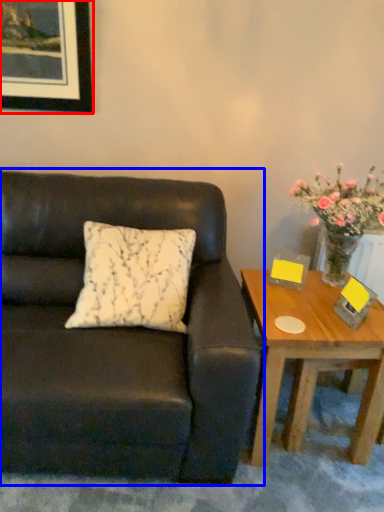
Question: Which of the following is the closest to the observer, picture frame (highlighted by a red box) or studio couch (highlighted by a blue box)?

Choices:
 (A) picture frame
 (B) studio couch

Answer: (B)